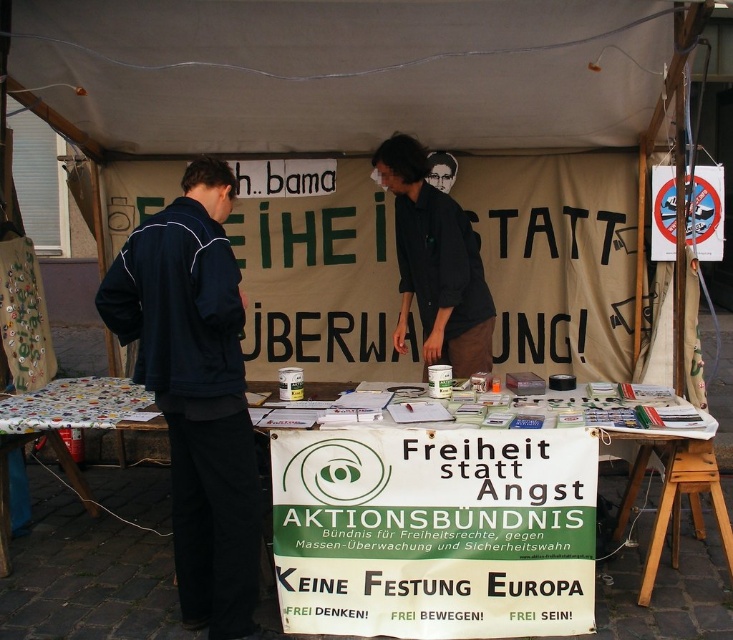
You are at an outdoor event and see the white paper table at center and the dark blue jacket at left. Which object is closer to you?

The white paper table at center is closer to you because the dark blue jacket at left is behind it.

You are a photographer at the event and want to capture a clear shot of both the white fabric canopy at upper center and the black matte shirt at center. Which object is closer to the camera, making it easier to focus on?

The white fabric canopy at upper center is closer to the camera than the black matte shirt at center because it is shorter, so focusing on it would be easier.